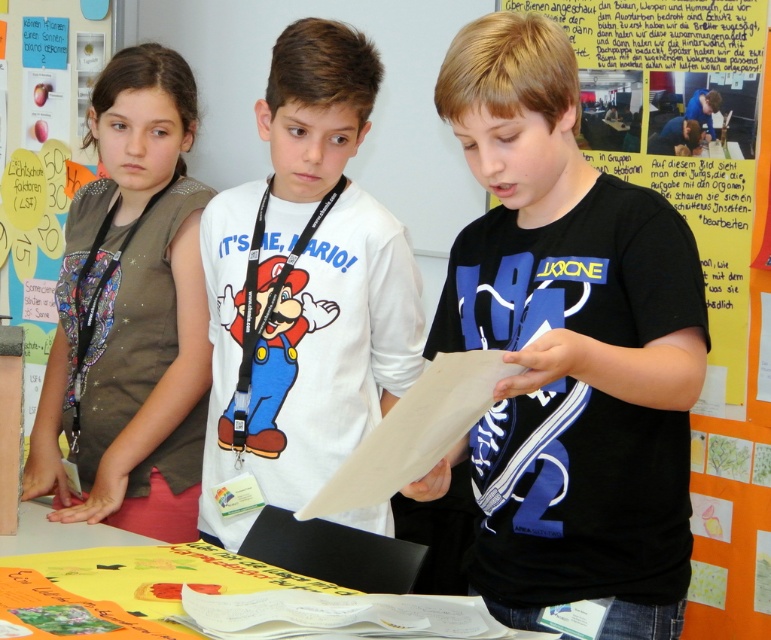
Question: Is matte brown vest at left behind yellow paper at lower center?

Choices:
 (A) no
 (B) yes

Answer: (B)

Question: Does white cotton t-shirt at center appear on the right side of yellow paper at lower center?

Choices:
 (A) yes
 (B) no

Answer: (A)

Question: Can you confirm if black matte paper at center is wider than yellow paper at lower center?

Choices:
 (A) yes
 (B) no

Answer: (A)

Question: Which object is positioned farthest from the multicolored fabric poster at left?

Choices:
 (A) white cotton t-shirt at center
 (B) matte brown vest at left
 (C) black matte paper at center
 (D) yellow paper at lower center

Answer: (C)

Question: Which point is farther to the camera?

Choices:
 (A) yellow paper at lower center
 (B) black matte paper at center

Answer: (A)

Question: Which object is the closest to the matte brown vest at left?

Choices:
 (A) yellow paper at lower center
 (B) multicolored fabric poster at left

Answer: (A)